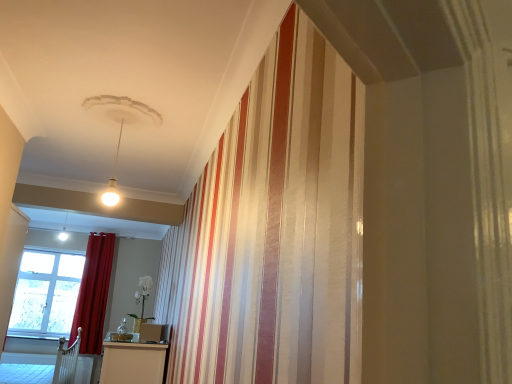
Find the location of a particular element. This screenshot has width=512, height=384. velvet red curtain at left is located at coordinates (93, 293).

Describe the element at coordinates (93, 293) in the screenshot. I see `velvet red curtain at left` at that location.

This screenshot has height=384, width=512. What are the coordinates of `clear glass window at lower left` in the screenshot? It's located at (46, 294).

The height and width of the screenshot is (384, 512). What do you see at coordinates (46, 294) in the screenshot?
I see `clear glass window at lower left` at bounding box center [46, 294].

Where is `velvet red curtain at left`? The width and height of the screenshot is (512, 384). velvet red curtain at left is located at coordinates (93, 293).

Would you say velvet red curtain at left is to the left or to the right of clear glass window at lower left in the picture?

velvet red curtain at left is to the right of clear glass window at lower left.

Which is in front, velvet red curtain at left or clear glass window at lower left?

velvet red curtain at left is in front.

Is point (106, 239) closer to camera compared to point (57, 321)?

Yes.

From the image's perspective, is velvet red curtain at left above or below clear glass window at lower left?

Based on their image positions, velvet red curtain at left is located above clear glass window at lower left.

From a real-world perspective, is velvet red curtain at left on clear glass window at lower left?

Yes.

Does velvet red curtain at left have a greater width compared to clear glass window at lower left?

Yes.

Is velvet red curtain at left taller or shorter than clear glass window at lower left?

In the image, velvet red curtain at left appears to be taller than clear glass window at lower left.

Who is bigger, velvet red curtain at left or clear glass window at lower left?

velvet red curtain at left.

Is clear glass window at lower left completely or partially inside velvet red curtain at left?

Definitely not — clear glass window at lower left is not inside velvet red curtain at left.

Does velvet red curtain at left touch clear glass window at lower left?

No, velvet red curtain at left is not next to clear glass window at lower left.

Is velvet red curtain at left oriented towards clear glass window at lower left?

No, velvet red curtain at left is not oriented towards clear glass window at lower left.

Locate an element on the screen. The height and width of the screenshot is (384, 512). window that is under the velvet red curtain at left (from a real-world perspective) is located at coordinates (46, 294).

Is clear glass window at lower left at the right side of velvet red curtain at left?

In fact, clear glass window at lower left is to the left of velvet red curtain at left.

Considering the relative positions of clear glass window at lower left and velvet red curtain at left in the image provided, is clear glass window at lower left behind velvet red curtain at left?

Yes.

Considering the points (57, 271) and (106, 233), which point is in front, point (57, 271) or point (106, 233)?

The point (106, 233) is closer.

From the image's perspective, which one is positioned lower, clear glass window at lower left or velvet red curtain at left?

clear glass window at lower left, from the image's perspective.

Looking at this image, from a real-world perspective, which object stands above the other?

velvet red curtain at left, from a real-world perspective.

Which of these two, clear glass window at lower left or velvet red curtain at left, is wider?

Wider between the two is velvet red curtain at left.

Considering the sizes of objects clear glass window at lower left and velvet red curtain at left in the image provided, who is shorter, clear glass window at lower left or velvet red curtain at left?

clear glass window at lower left is shorter.

Considering the relative sizes of clear glass window at lower left and velvet red curtain at left in the image provided, is clear glass window at lower left smaller than velvet red curtain at left?

Yes, clear glass window at lower left is smaller than velvet red curtain at left.

Can velvet red curtain at left be found inside clear glass window at lower left?

No, velvet red curtain at left is not inside clear glass window at lower left.

Is clear glass window at lower left not near velvet red curtain at left?

No, clear glass window at lower left is not far from velvet red curtain at left.

Is clear glass window at lower left facing away from velvet red curtain at left?

clear glass window at lower left does not have its back to velvet red curtain at left.

You are a GUI agent. You are given a task and a screenshot of the screen. Output one action in this format:
    pyautogui.click(x=<x>, y=<y>)
    Task: Click on the curtain on the right of clear glass window at lower left
    
    Given the screenshot: What is the action you would take?
    [93, 293]

In order to click on curtain lying above the clear glass window at lower left (from the image's perspective) in this screenshot , I will do click(93, 293).

I want to click on window lying below the velvet red curtain at left (from the image's perspective), so click(x=46, y=294).